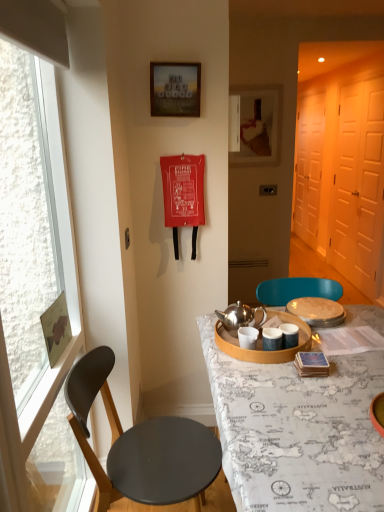
Question: Considering the relative sizes of wooden picture frame at upper center, which ranks as the first picture frame in back-to-front order, and white matte screen door at right, the 1th screen door when ordered from back to front, in the image provided, is wooden picture frame at upper center, which ranks as the first picture frame in back-to-front order, thinner than white matte screen door at right, the 1th screen door when ordered from back to front,?

Choices:
 (A) no
 (B) yes

Answer: (B)

Question: Does wooden picture frame at upper center, the second picture frame in the front-to-back sequence, come behind white matte screen door at right, placed as the 2th screen door when sorted from front to back?

Choices:
 (A) no
 (B) yes

Answer: (A)

Question: Does wooden picture frame at upper center, the second picture frame in the front-to-back sequence, have a smaller size compared to white matte screen door at right, placed as the 2th screen door when sorted from front to back?

Choices:
 (A) yes
 (B) no

Answer: (A)

Question: Does wooden picture frame at upper center, which ranks as the first picture frame in back-to-front order, have a greater height compared to white matte screen door at right, the 1th screen door when ordered from back to front?

Choices:
 (A) no
 (B) yes

Answer: (A)

Question: Is wooden picture frame at upper center, which ranks as the first picture frame in back-to-front order, in front of white matte screen door at right, placed as the 2th screen door when sorted from front to back?

Choices:
 (A) no
 (B) yes

Answer: (B)

Question: Could you tell me if wooden picture frame at upper center, which is counted as the 1th picture frame, starting from the right, is turned towards white matte screen door at right, the 1th screen door when ordered from back to front?

Choices:
 (A) no
 (B) yes

Answer: (A)

Question: Does clear glass window at left have a larger size compared to wooden frame at upper center, the 1th picture frame in the left-to-right sequence?

Choices:
 (A) no
 (B) yes

Answer: (B)

Question: Is the surface of clear glass window at left in direct contact with wooden frame at upper center, the second picture frame from the back?

Choices:
 (A) yes
 (B) no

Answer: (B)

Question: Are clear glass window at left and wooden frame at upper center, the 1th picture frame in the left-to-right sequence, located far from each other?

Choices:
 (A) no
 (B) yes

Answer: (A)

Question: Is clear glass window at left further to the viewer compared to wooden frame at upper center, the second picture frame from the back?

Choices:
 (A) no
 (B) yes

Answer: (A)

Question: Can you confirm if clear glass window at left is thinner than wooden frame at upper center, the 2th picture frame in the right-to-left sequence?

Choices:
 (A) no
 (B) yes

Answer: (A)

Question: From a real-world perspective, is clear glass window at left below wooden frame at upper center, the 1th picture frame in the left-to-right sequence?

Choices:
 (A) yes
 (B) no

Answer: (A)

Question: From a real-world perspective, is white matte screen door at right, the 1th screen door when ordered from back to front, under wooden picture frame at upper center, which is counted as the 1th picture frame, starting from the right?

Choices:
 (A) no
 (B) yes

Answer: (B)